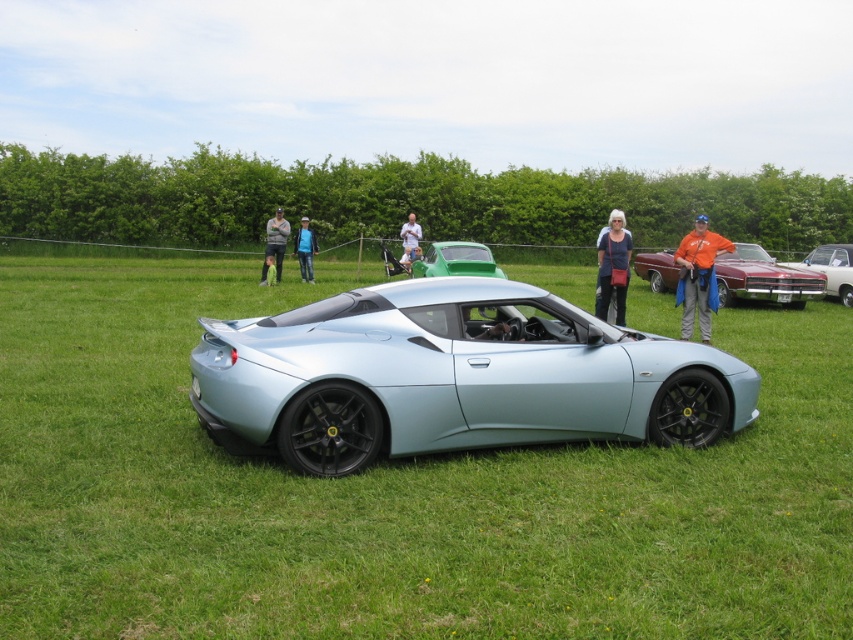
Question: Which object appears farthest from the camera in this image?

Choices:
 (A) orange fabric vest at right
 (B) metallic silver car at right

Answer: (B)

Question: Observing the image, what is the correct spatial positioning of shiny red car at center in reference to blue denim jeans at center?

Choices:
 (A) left
 (B) right

Answer: (B)

Question: Does metallic silver car at right have a smaller size compared to blue denim jeans at center?

Choices:
 (A) yes
 (B) no

Answer: (B)

Question: Among these points, which one is nearest to the camera?

Choices:
 (A) (302, 264)
 (B) (605, 307)

Answer: (B)

Question: Which object is closer to the camera taking this photo?

Choices:
 (A) matte silver sports car at center
 (B) matte blue dress at center
 (C) shiny red car at center
 (D) metallic silver car at right

Answer: (A)

Question: Is matte blue dress at center to the left of white fabric shirt at center from the viewer's perspective?

Choices:
 (A) no
 (B) yes

Answer: (A)